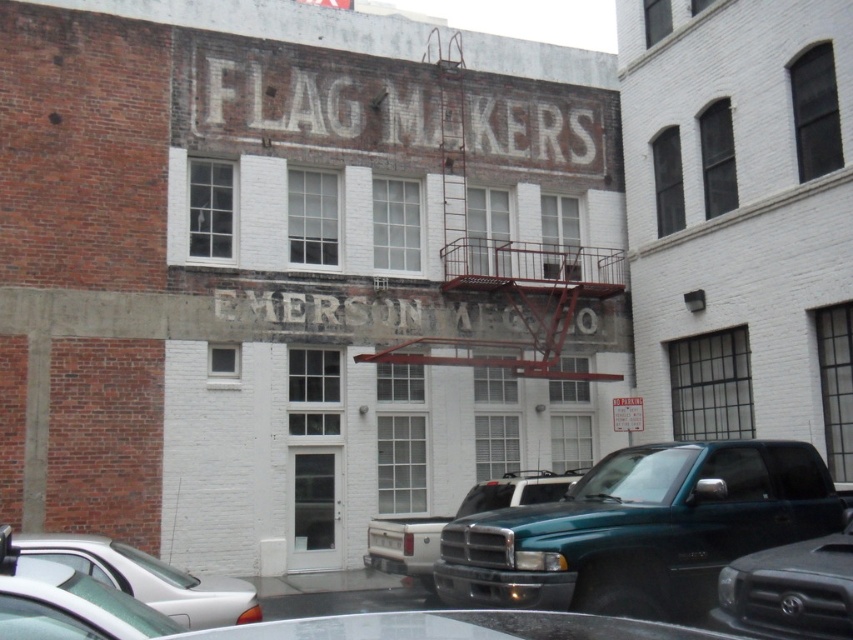
Question: Which point is farther to the camera?

Choices:
 (A) teal matte truck at center
 (B) rusty metal fire escape at upper center
 (C) green matte truck at lower right
 (D) teal glossy pickup truck at center

Answer: (B)

Question: Is teal glossy pickup truck at center smaller than white glossy sedan at lower left?

Choices:
 (A) yes
 (B) no

Answer: (A)

Question: Can you confirm if rusty metal fire escape at upper center is positioned to the left of white glossy sedan at lower left?

Choices:
 (A) yes
 (B) no

Answer: (B)

Question: Which of these objects is positioned closest to the teal matte truck at center?

Choices:
 (A) teal glossy pickup truck at center
 (B) white glossy sedan at lower left
 (C) green matte truck at lower right

Answer: (B)

Question: Considering the real-world distances, which object is farthest from the rusty metal fire escape at upper center?

Choices:
 (A) teal matte truck at center
 (B) green matte truck at lower right
 (C) white glossy sedan at lower left
 (D) teal glossy pickup truck at center

Answer: (B)

Question: Is teal glossy pickup truck at center below white glossy sedan at lower left?

Choices:
 (A) no
 (B) yes

Answer: (A)